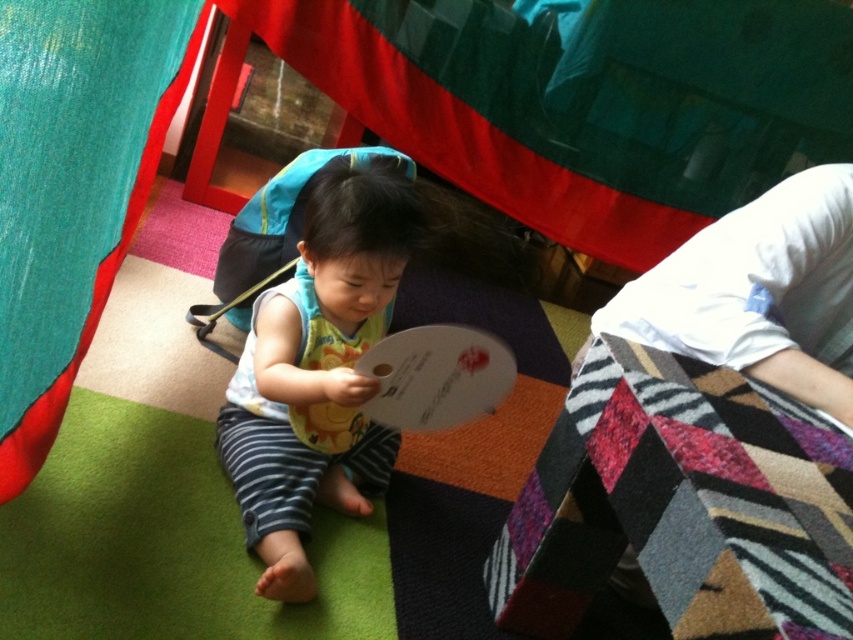
Does multicolored woven quilt at lower right appear on the left side of matte white bib at center?

In fact, multicolored woven quilt at lower right is to the right of matte white bib at center.

Who is more forward, (811, 563) or (305, 330)?

Point (811, 563) is in front.

Between point (579, 442) and point (321, 196), which one is positioned in front?

Point (579, 442) is in front.

At what (x,y) coordinates should I click in order to perform the action: click on multicolored woven quilt at lower right. Please return your answer as a coordinate pair (x, y). Looking at the image, I should click on (682, 506).